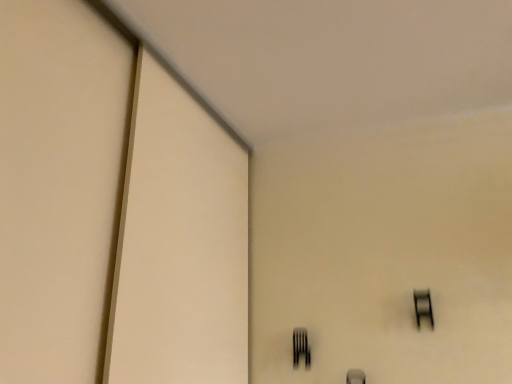
Question: Can you confirm if black glass window at upper right is wider than black matte fork at lower center?

Choices:
 (A) yes
 (B) no

Answer: (B)

Question: Is the depth of black glass window at upper right greater than that of black matte fork at lower center?

Choices:
 (A) no
 (B) yes

Answer: (A)

Question: Is black glass window at upper right smaller than black matte fork at lower center?

Choices:
 (A) yes
 (B) no

Answer: (B)

Question: Is black glass window at upper right to the right of black matte fork at lower center from the viewer's perspective?

Choices:
 (A) yes
 (B) no

Answer: (A)

Question: Could you tell me if black glass window at upper right is facing black matte fork at lower center?

Choices:
 (A) yes
 (B) no

Answer: (B)

Question: Is black matte fork at lower center surrounded by black glass window at upper right?

Choices:
 (A) no
 (B) yes

Answer: (A)

Question: Could you tell me if black matte fork at lower center is turned towards black glass window at upper right?

Choices:
 (A) no
 (B) yes

Answer: (A)

Question: From a real-world perspective, is black matte fork at lower center positioned under black glass window at upper right based on gravity?

Choices:
 (A) yes
 (B) no

Answer: (A)

Question: Considering the relative positions of black matte fork at lower center and black glass window at upper right in the image provided, is black matte fork at lower center to the left of black glass window at upper right from the viewer's perspective?

Choices:
 (A) yes
 (B) no

Answer: (A)

Question: Is black matte fork at lower center oriented away from black glass window at upper right?

Choices:
 (A) no
 (B) yes

Answer: (A)

Question: From a real-world perspective, is black matte fork at lower center physically above black glass window at upper right?

Choices:
 (A) yes
 (B) no

Answer: (B)

Question: Is black matte fork at lower center touching black glass window at upper right?

Choices:
 (A) yes
 (B) no

Answer: (B)

Question: From the image's perspective, is black glass window at upper right above or below black matte fork at lower center?

Choices:
 (A) below
 (B) above

Answer: (B)